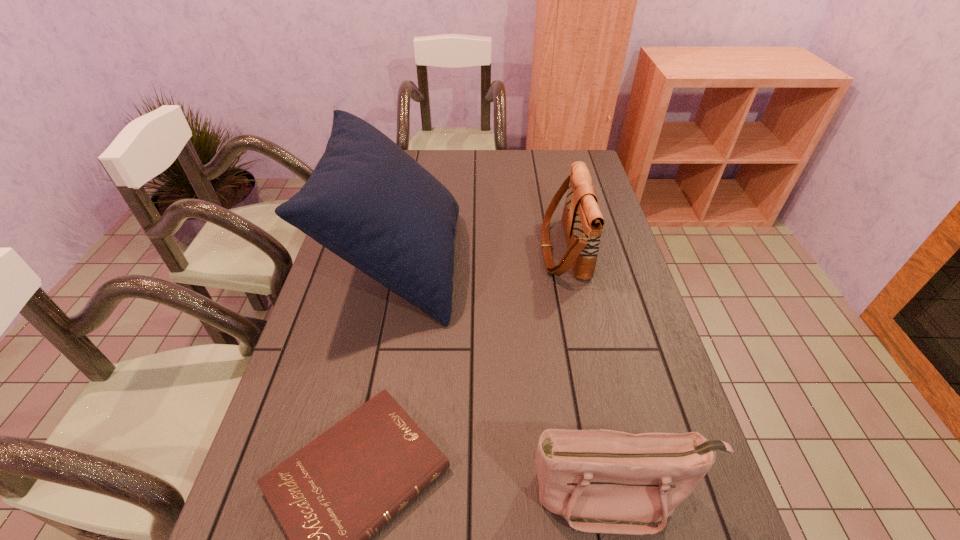
Find the location of a particular element. The height and width of the screenshot is (540, 960). the tallest object is located at coordinates (369, 202).

You are a GUI agent. You are given a task and a screenshot of the screen. Output one action in this format:
    pyautogui.click(x=<x>, y=<y>)
    Task: Click on the farther shoulder bag
    The width and height of the screenshot is (960, 540).
    Given the screenshot: What is the action you would take?
    pyautogui.click(x=582, y=220)

Find the location of a particular element. the third shortest object is located at coordinates (582, 220).

Locate an element on the screen. the third tallest object is located at coordinates (603, 481).

You are a GUI agent. You are given a task and a screenshot of the screen. Output one action in this format:
    pyautogui.click(x=<x>, y=<y>)
    Task: Click on the shorter shoulder bag
    The width and height of the screenshot is (960, 540).
    Given the screenshot: What is the action you would take?
    pyautogui.click(x=603, y=481)

Locate an element on the screen. vacant space located 0.050m on the facing side of the tallest object is located at coordinates (474, 262).

This screenshot has width=960, height=540. In order to click on vacant space located on the front-facing side of the farther shoulder bag in this screenshot , I will do `click(512, 249)`.

In order to click on blank space located on the front-facing side of the farther shoulder bag in this screenshot , I will do `click(509, 249)`.

Where is `vacant space located 0.300m on the front-facing side of the farther shoulder bag`? The height and width of the screenshot is (540, 960). vacant space located 0.300m on the front-facing side of the farther shoulder bag is located at coordinates (443, 249).

Locate an element on the screen. object at the left edge is located at coordinates (369, 202).